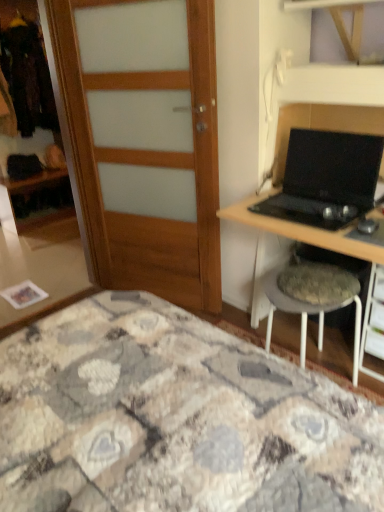
What do you see at coordinates (142, 141) in the screenshot? The width and height of the screenshot is (384, 512). I see `wooden door at left` at bounding box center [142, 141].

Identify the location of black plastic mouse at right. tap(367, 226).

What do you see at coordinates (367, 226) in the screenshot?
I see `black plastic mouse at right` at bounding box center [367, 226].

Measure the distance between point (311, 191) and camera.

A distance of 5.90 feet exists between point (311, 191) and camera.

The image size is (384, 512). What do you see at coordinates (372, 309) in the screenshot? I see `black plastic drawer at lower right` at bounding box center [372, 309].

Locate an element on the screen. textured fabric stool at right is located at coordinates (313, 298).

Does point (294, 273) appear closer or farther from the camera than point (309, 195)?

Point (294, 273) appears to be closer to the viewer than point (309, 195).

From the image's perspective, between textured fabric stool at right and black matte laptop at right, who is located below?

textured fabric stool at right, from the image's perspective.

Which of these two, textured fabric stool at right or black matte laptop at right, is bigger?

With larger size is textured fabric stool at right.

In the image, there is a black matte laptop at right. In order to click on stool below it (from a real-world perspective) in this screenshot , I will do `click(313, 298)`.

Considering the points (376, 267) and (302, 157), which point is behind, point (376, 267) or point (302, 157)?

Positioned behind is point (302, 157).

Considering the relative sizes of black plastic drawer at lower right and black matte laptop at right in the image provided, is black plastic drawer at lower right bigger than black matte laptop at right?

Incorrect, black plastic drawer at lower right is not larger than black matte laptop at right.

Does black plastic drawer at lower right appear on the right side of black matte laptop at right?

Correct, you'll find black plastic drawer at lower right to the right of black matte laptop at right.

Measure the distance between black plastic drawer at lower right and black matte laptop at right.

black plastic drawer at lower right and black matte laptop at right are 17.16 inches apart from each other.

Does wooden door at left have a greater width compared to black plastic mouse at right?

Correct, the width of wooden door at left exceeds that of black plastic mouse at right.

Considering the relative sizes of wooden door at left and black plastic mouse at right in the image provided, is wooden door at left taller than black plastic mouse at right?

Indeed, wooden door at left has a greater height compared to black plastic mouse at right.

Is wooden door at left situated inside black plastic mouse at right or outside?

Result: wooden door at left lies outside black plastic mouse at right.

From the image's perspective, does wooden door at left appear lower than black plastic mouse at right?

No.

Considering the sizes of objects textured fabric stool at right and matte wood wardrobe at left in the image provided, who is wider, textured fabric stool at right or matte wood wardrobe at left?

textured fabric stool at right is wider.

Are textured fabric stool at right and matte wood wardrobe at left beside each other?

textured fabric stool at right and matte wood wardrobe at left are not in contact.

Locate an element on the screen. cabinetry on the left of black plastic mouse at right is located at coordinates (30, 124).

Is black plastic mouse at right at the right side of matte wood wardrobe at left?

Correct, you'll find black plastic mouse at right to the right of matte wood wardrobe at left.

Measure the distance between black plastic mouse at right and matte wood wardrobe at left.

black plastic mouse at right and matte wood wardrobe at left are 3.06 meters apart.

Which of these two, black plastic mouse at right or matte wood wardrobe at left, stands taller?

matte wood wardrobe at left.

Would you consider black matte laptop at right to be distant from black plastic mouse at right?

No, there isn't a large distance between black matte laptop at right and black plastic mouse at right.

Considering the points (324, 143) and (375, 224), which point is in front, point (324, 143) or point (375, 224)?

The point (375, 224) is closer to the camera.

How much distance is there between black matte laptop at right and black plastic mouse at right?

A distance of 10.54 inches exists between black matte laptop at right and black plastic mouse at right.

Locate an element on the screen. This screenshot has width=384, height=512. laptop above the black plastic mouse at right (from a real-world perspective) is located at coordinates (326, 179).

Measure the distance between wooden door at left and black plastic drawer at lower right.

wooden door at left is 1.25 meters from black plastic drawer at lower right.

Choose the correct answer: Is wooden door at left inside black plastic drawer at lower right or outside it?

wooden door at left is not enclosed by black plastic drawer at lower right.

In terms of width, does wooden door at left look wider or thinner when compared to black plastic drawer at lower right?

In the image, wooden door at left appears to be more narrow than black plastic drawer at lower right.

Does wooden door at left have a larger size compared to black plastic drawer at lower right?

Yes.

Identify the location of stool located behind the black matte laptop at right. The image size is (384, 512). (313, 298).

In the image, there is a black plastic drawer at lower right. Where is `laptop above it (from the image's perspective)`? This screenshot has height=512, width=384. laptop above it (from the image's perspective) is located at coordinates (326, 179).

Estimate the real-world distances between objects in this image. Which object is further from black matte laptop at right, textured fabric stool at right or black plastic drawer at lower right?

black plastic drawer at lower right.

When comparing their distances from wooden door at left, does black matte laptop at right or black plastic drawer at lower right seem further?

black plastic drawer at lower right.

Based on their spatial positions, is textured fabric stool at right or black matte laptop at right further from matte wood wardrobe at left?

The object further to matte wood wardrobe at left is textured fabric stool at right.

Based on their spatial positions, is wooden door at left or black plastic mouse at right closer to matte wood wardrobe at left?

wooden door at left.

From the picture: From the image, which object appears to be nearer to black plastic drawer at lower right, black matte laptop at right or matte wood wardrobe at left?

black matte laptop at right is positioned closer to the anchor black plastic drawer at lower right.

From the image, which object appears to be nearer to black plastic drawer at lower right, textured fabric stool at right or black plastic mouse at right?

textured fabric stool at right is positioned closer to the anchor black plastic drawer at lower right.

Considering their positions, is wooden door at left positioned further to black matte laptop at right than textured fabric stool at right?

wooden door at left is positioned further to the anchor black matte laptop at right.

When comparing their distances from black plastic drawer at lower right, does textured fabric stool at right or wooden door at left seem further?

The object further to black plastic drawer at lower right is wooden door at left.

This screenshot has height=512, width=384. Identify the location of laptop between wooden door at left and black plastic drawer at lower right in the horizontal direction. (326, 179).

Identify the location of laptop between wooden door at left and black plastic mouse at right in the horizontal direction. The height and width of the screenshot is (512, 384). (326, 179).

You are a GUI agent. You are given a task and a screenshot of the screen. Output one action in this format:
    pyautogui.click(x=<x>, y=<y>)
    Task: Click on the laptop located between matte wood wardrobe at left and textured fabric stool at right in the left-right direction
    The height and width of the screenshot is (512, 384).
    Given the screenshot: What is the action you would take?
    pyautogui.click(x=326, y=179)

Find the location of a particular element. laptop between matte wood wardrobe at left and black plastic drawer at lower right is located at coordinates (326, 179).